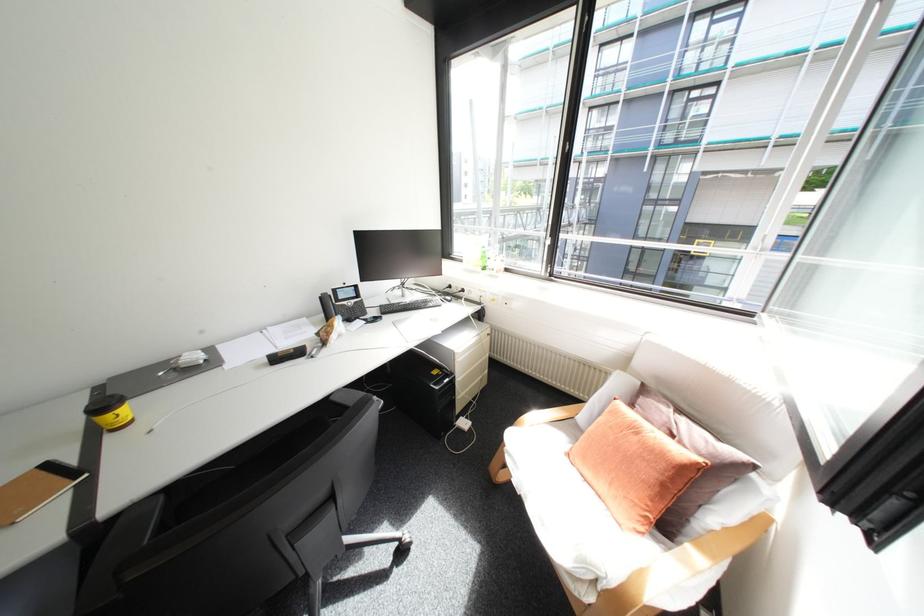
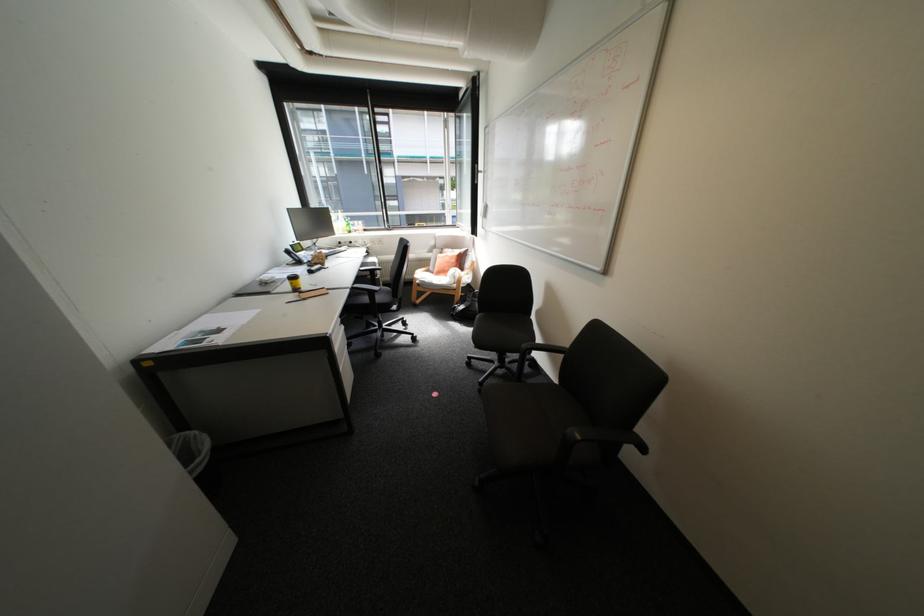
Where in the second image is the point corresponding to point 677,410 from the first image?

(459, 249)